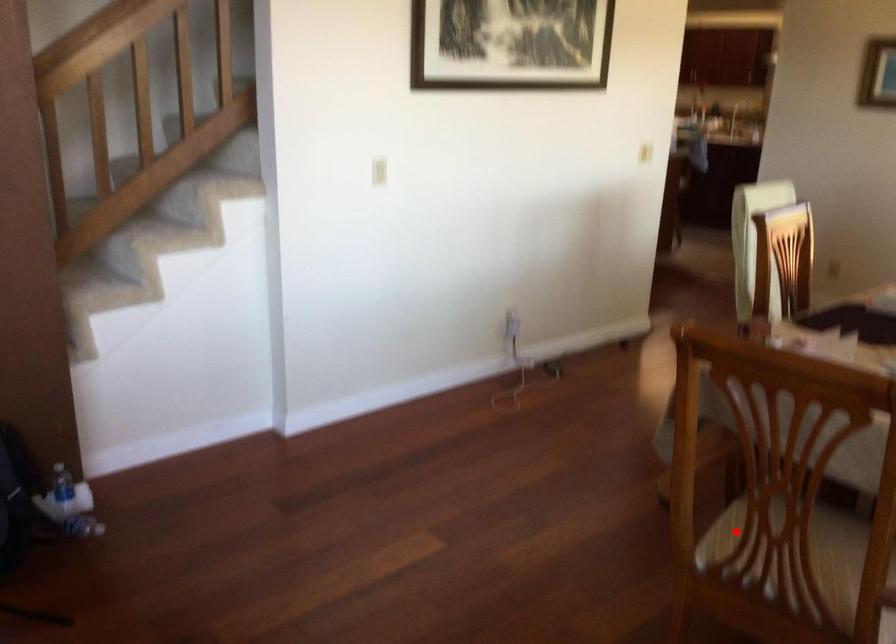
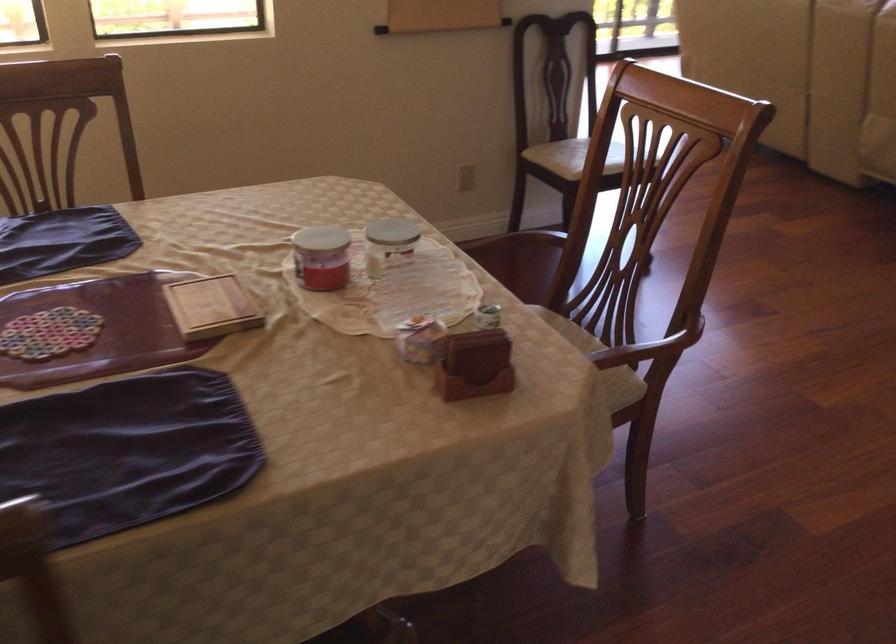
Question: I am providing you with two images of the same scene from different viewpoints. A red point is marked on the first image. Can you still see the location of the red point in image 2?

Choices:
 (A) Yes
 (B) No

Answer: (B)